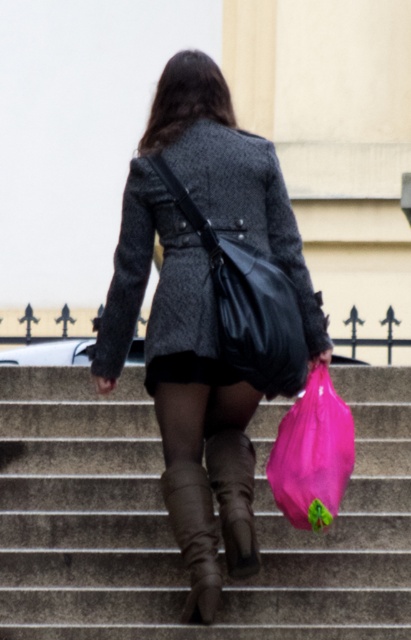
You are a drone operator trying to capture a photo of the matte black coat at center from above. The drone has a maximum safe flying distance of 30 meters. Can the drone safely take the photo without exceeding its limit?

The distance between the matte black coat at center and the camera is 28.68 meters, which is under the drone s 30 meter limit. Yes, the drone can safely take the photo.

The person is holding a pink plastic bag at lower center and a leather at center. Which item is closer to the viewer?

The pink plastic bag at lower center is positioned over the leather at center, meaning it is closer to the viewer.

You are a photographer standing at the bottom of the stairs. You want to take a photo of the pink plastic bag at lower center. Considering the distance, will you need a zoom lens to capture it clearly?

The pink plastic bag at lower center is 96.94 feet from the camera, so a zoom lens would be necessary to capture it clearly from that distance.